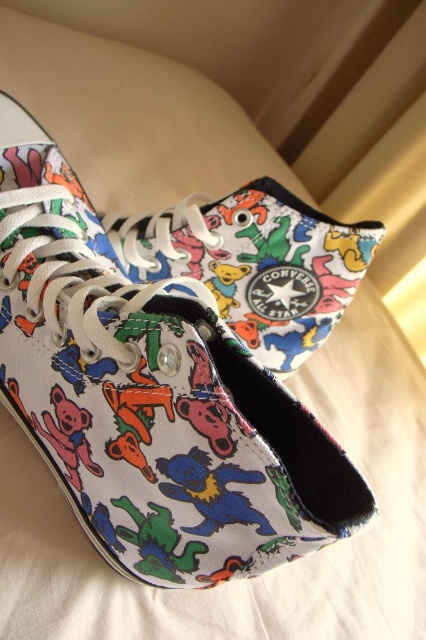
Question: Is canvas sneakers at center further to the viewer compared to multicolored canvas sneakers at center?

Choices:
 (A) no
 (B) yes

Answer: (A)

Question: Which of the following is the farthest from the observer?

Choices:
 (A) (123, 227)
 (B) (261, 448)

Answer: (A)

Question: Does canvas sneakers at center appear on the left side of multicolored canvas sneakers at center?

Choices:
 (A) no
 (B) yes

Answer: (B)

Question: Does canvas sneakers at center appear over multicolored canvas sneakers at center?

Choices:
 (A) yes
 (B) no

Answer: (B)